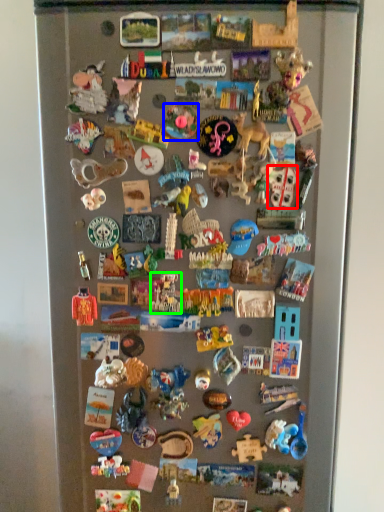
Question: Considering the real-world distances, which object is farthest from toy (highlighted by a red box)? toy (highlighted by a blue box) or toy (highlighted by a green box)?

Choices:
 (A) toy
 (B) toy

Answer: (B)